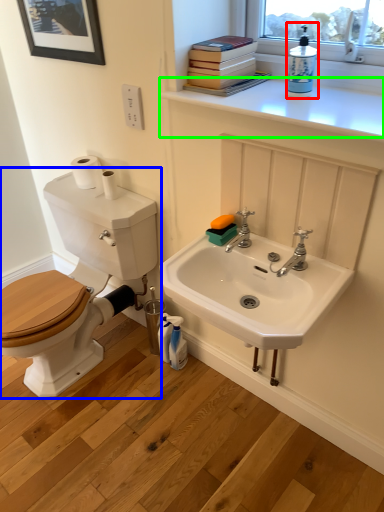
Question: Considering the real-world distances, which object is closest to cleaning product (highlighted by a red box)? toilet (highlighted by a blue box) or counter top (highlighted by a green box).

Choices:
 (A) toilet
 (B) counter top

Answer: (B)